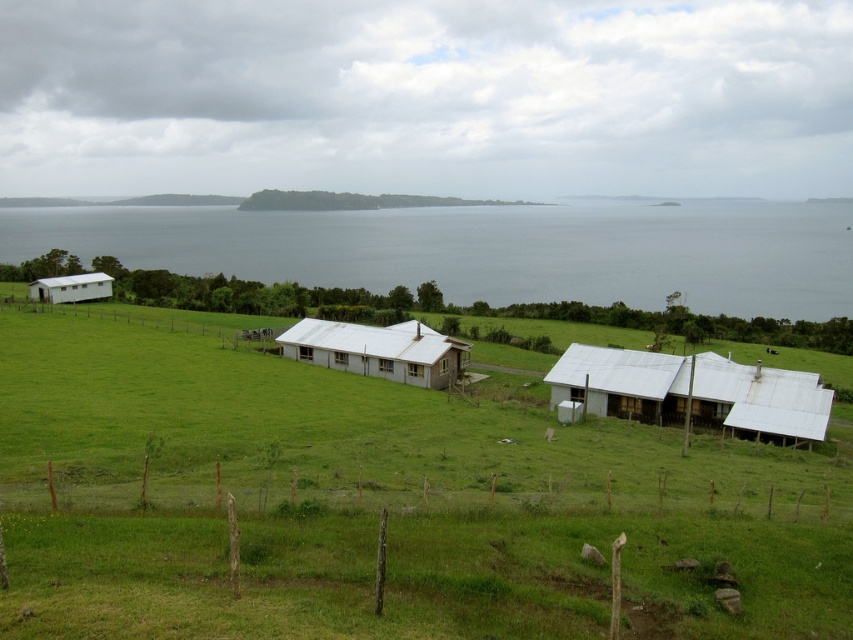
Is blue water at center to the left of white corrugated metal barn at center from the viewer's perspective?

No, blue water at center is not to the left of white corrugated metal barn at center.

Who is more forward, (x=666, y=250) or (x=379, y=362)?

Positioned in front is point (x=379, y=362).

This screenshot has width=853, height=640. I want to click on blue water at center, so pyautogui.click(x=489, y=250).

Between point (247, 236) and point (782, 413), which one is positioned behind?

Point (247, 236)

Describe the element at coordinates (489, 250) in the screenshot. I see `blue water at center` at that location.

Is point (515, 268) more distant than point (554, 387)?

Yes, point (515, 268) is behind point (554, 387).

Locate an element on the screen. blue water at center is located at coordinates (489, 250).

Between point (486, 216) and point (88, 292), which one is positioned in front?

Point (88, 292) is more forward.

Can you confirm if blue water at center is positioned above white matte barn at left?

Yes.

I want to click on blue water at center, so pyautogui.click(x=489, y=250).